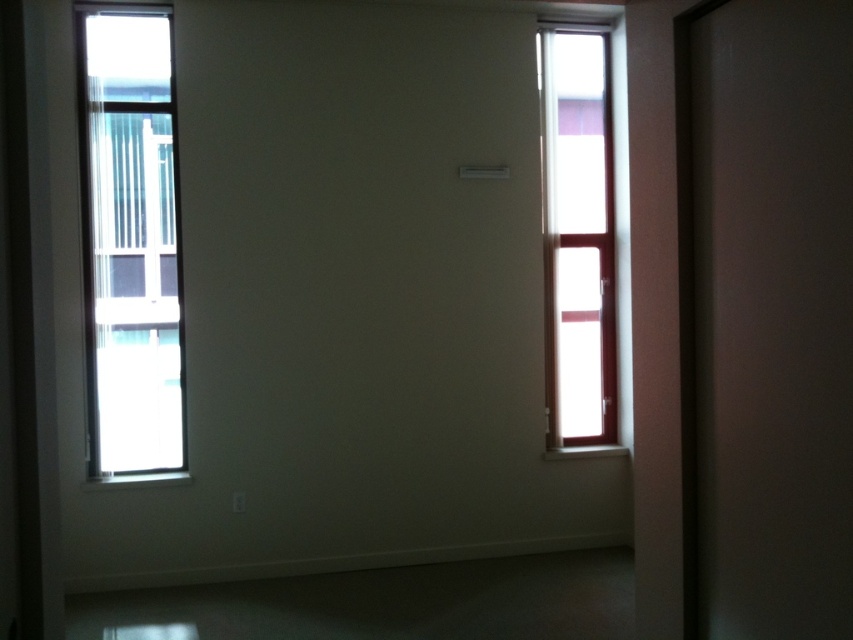
Question: Does transparent glass screen door at right appear over clear glass window at right?

Choices:
 (A) no
 (B) yes

Answer: (A)

Question: Where is transparent glass screen door at right located in relation to clear glass window at left in the image?

Choices:
 (A) above
 (B) below

Answer: (B)

Question: Based on their relative distances, which object is farther from the transparent glass screen door at right?

Choices:
 (A) clear glass window at right
 (B) clear glass window at left

Answer: (B)

Question: Among these objects, which one is nearest to the camera?

Choices:
 (A) transparent glass screen door at right
 (B) clear glass window at right
 (C) clear glass window at left

Answer: (A)

Question: Which of the following is the closest to the observer?

Choices:
 (A) (132, 307)
 (B) (572, 320)

Answer: (A)

Question: In this image, where is transparent glass screen door at right located relative to clear glass window at left?

Choices:
 (A) right
 (B) left

Answer: (A)